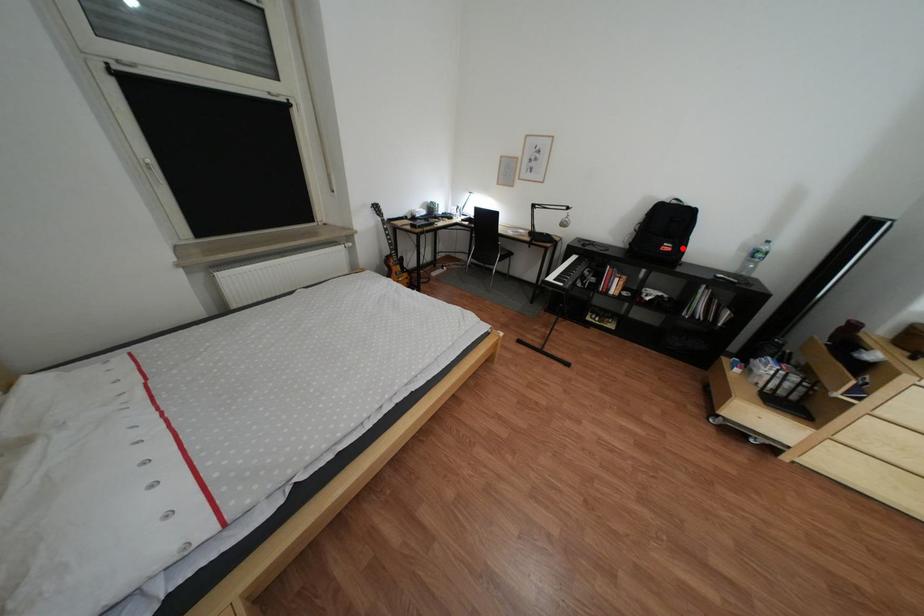
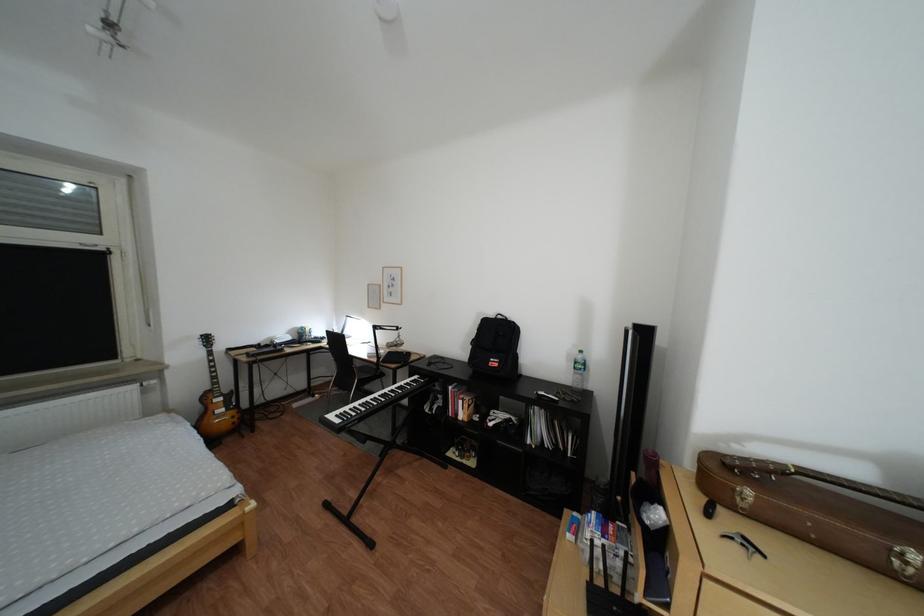
Where in the second image is the point corresponding to the highlighted location from the first image?

(509, 363)